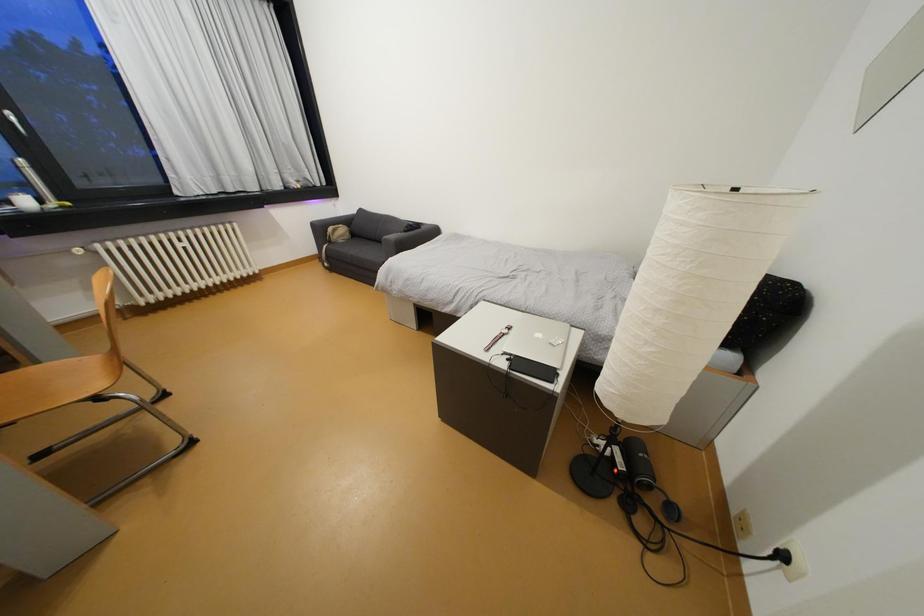
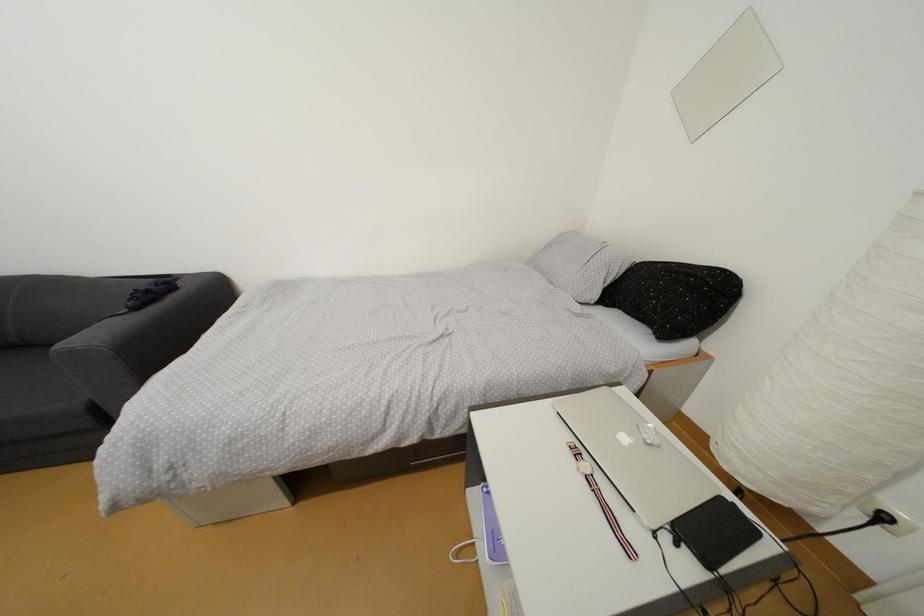
Question: The first image is from the beginning of the video and the second image is from the end. How did the camera likely rotate when shooting the video?

Choices:
 (A) Left
 (B) Right
 (C) Up
 (D) Down

Answer: (B)